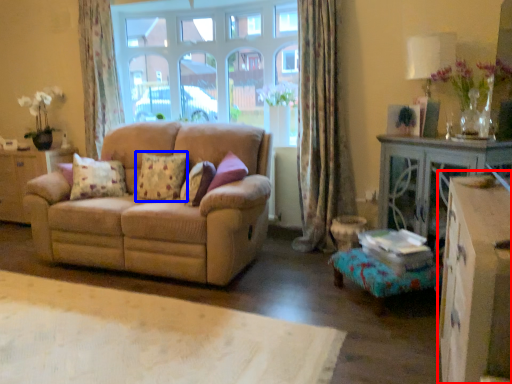
Question: Which object appears closest to the camera in this image, dresser (highlighted by a red box) or pillow (highlighted by a blue box)?

Choices:
 (A) dresser
 (B) pillow

Answer: (A)